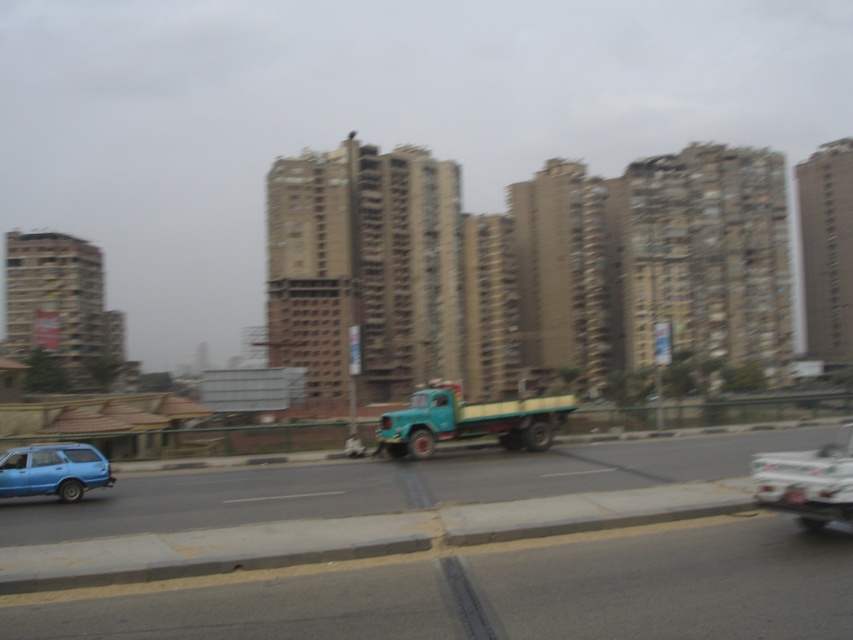
You are standing at the center of the road in the urban scene. There are two points marked on the buildings in front of you. Which point is closer to you, point (352, 488) or point (822, 460)?

Point (352, 488) is closer to you because it is further to the viewer than point (822, 460).

You are standing at the origin point of the scene. Which of the two points, point (782, 456) or point (70, 481), is closer to you?

Point (782, 456) is in front of point (70, 481), so it is closer to you.

You are standing at the camera position and want to reach the point at coordinates [448,396]. Given that you can walk at a speed of 3 feet per second, how many seconds will it take you to reach that point?

The point at coordinates [448,396] is 96.80 feet away from the camera. At a walking speed of 3 feet per second, it would take approximately 32.27 seconds to reach the point.